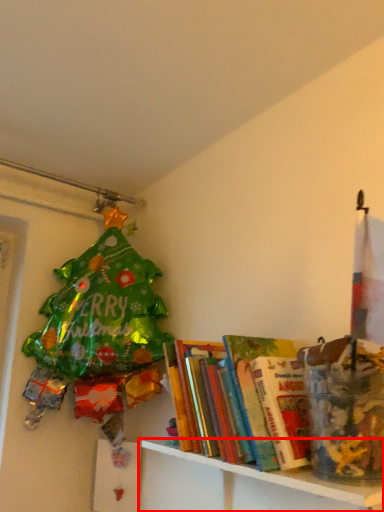
Question: Considering the relative positions of shelf (annotated by the red box) and book in the image provided, where is shelf (annotated by the red box) located with respect to the staircase?

Choices:
 (A) left
 (B) right

Answer: (B)